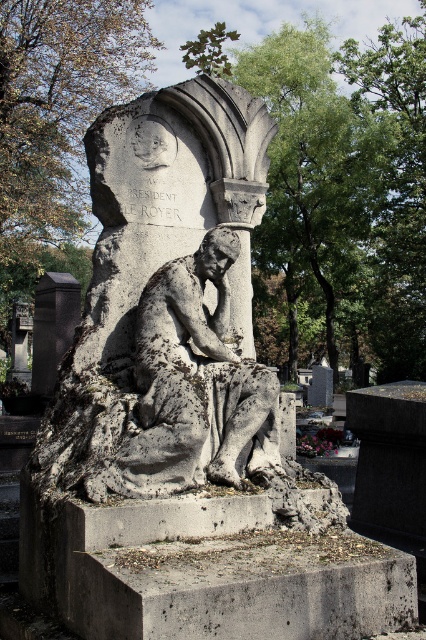
Is gray stone statue at center shorter than black stone pillar at lower left?

Incorrect, gray stone statue at center's height does not fall short of black stone pillar at lower left's.

Does gray stone statue at center appear on the left side of black stone pillar at lower left?

No, gray stone statue at center is not to the left of black stone pillar at lower left.

Who is more forward, (58, 429) or (54, 300)?

Positioned in front is point (58, 429).

You are a GUI agent. You are given a task and a screenshot of the screen. Output one action in this format:
    pyautogui.click(x=<x>, y=<y>)
    Task: Click on the gray stone statue at center
    The image size is (426, 640).
    Given the screenshot: What is the action you would take?
    pyautogui.click(x=169, y=305)